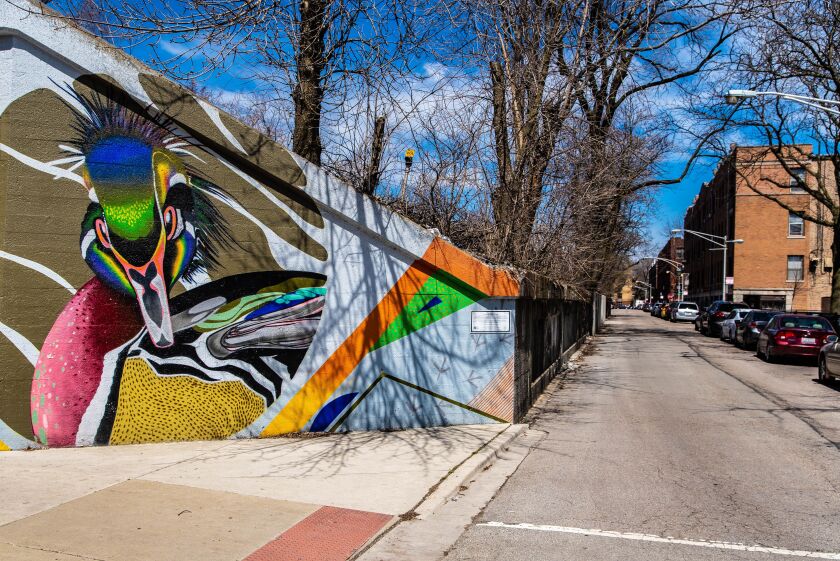
Image resolution: width=840 pixels, height=561 pixels. Find the location of `red chest`. red chest is located at coordinates (71, 352).